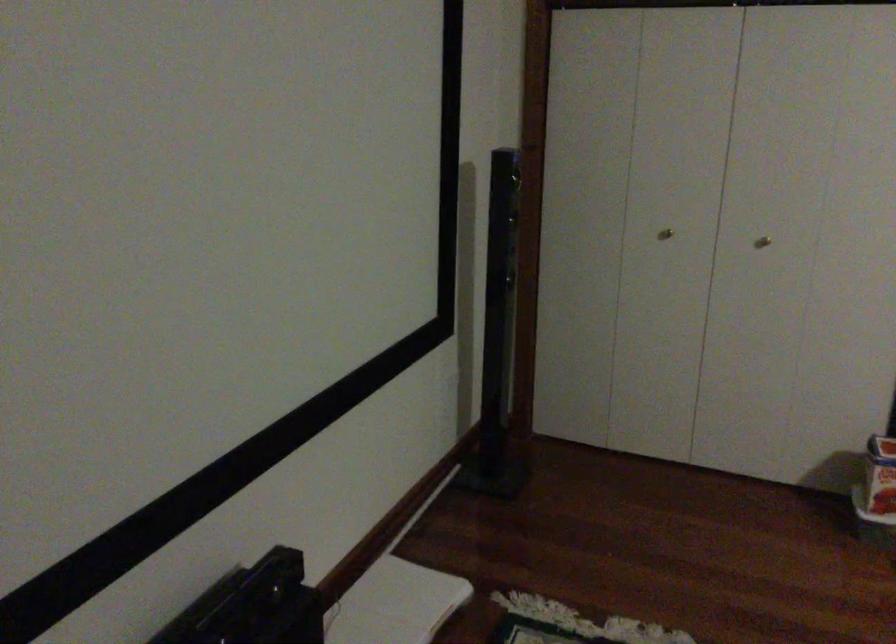
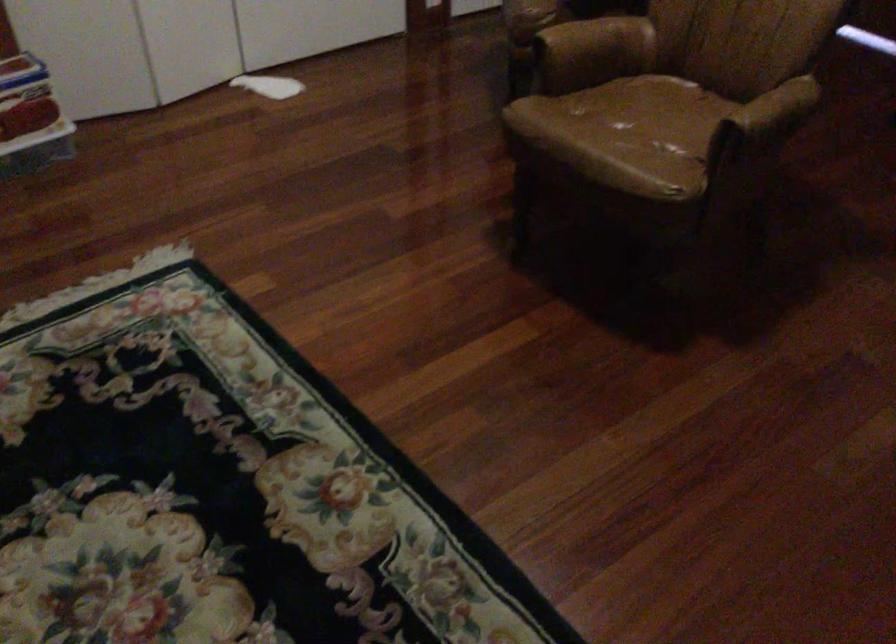
From the picture: The first image is from the beginning of the video and the second image is from the end. How did the camera likely rotate when shooting the video?

The camera rotated toward right-down.